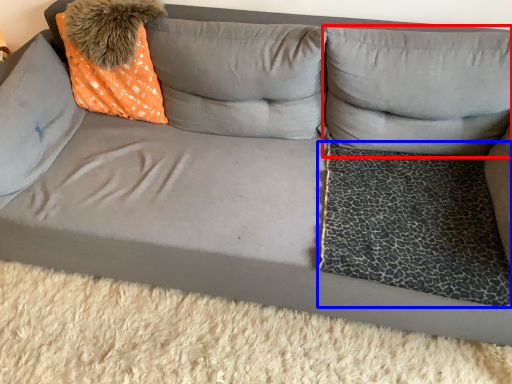
Question: Among these objects, which one is farthest to the camera, pillow (highlighted by a red box) or dog bed (highlighted by a blue box)?

Choices:
 (A) pillow
 (B) dog bed

Answer: (A)